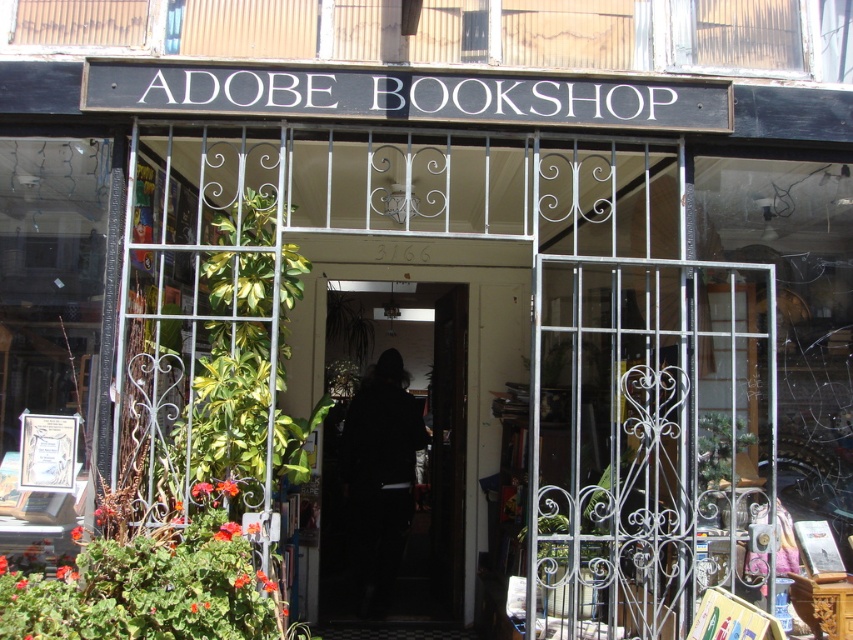
Question: Which object appears farthest from the camera in this image?

Choices:
 (A) black fabric door at center
 (B) metallic wrought iron gate at center

Answer: (A)

Question: Is metallic wrought iron gate at center wider than black fabric door at center?

Choices:
 (A) no
 (B) yes

Answer: (B)

Question: Which point is closer to the camera?

Choices:
 (A) (727, 484)
 (B) (434, 493)

Answer: (A)

Question: Considering the relative positions of metallic wrought iron gate at center and black fabric door at center in the image provided, where is metallic wrought iron gate at center located with respect to black fabric door at center?

Choices:
 (A) right
 (B) left

Answer: (A)

Question: Is metallic wrought iron gate at center in front of black fabric door at center?

Choices:
 (A) yes
 (B) no

Answer: (A)